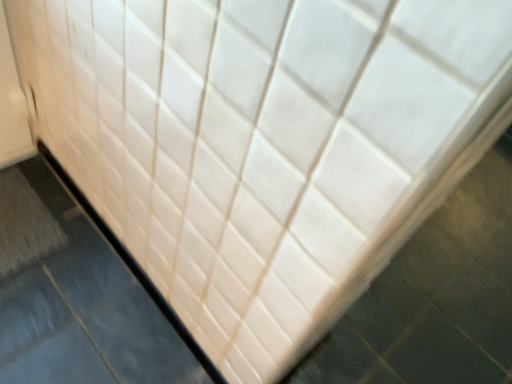
Identify the location of vacant space situated above beige glossy slate at lower left (from a real-world perspective). The width and height of the screenshot is (512, 384). (105, 227).